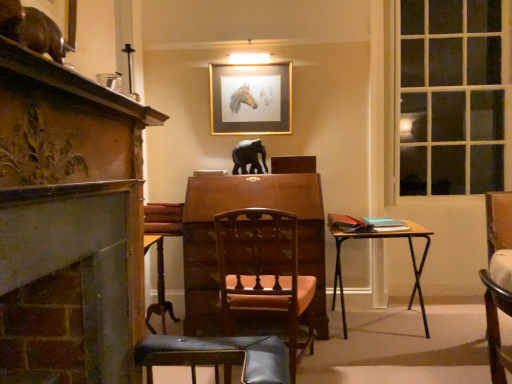
Question: Is gold metallic picture frame at upper center not within carved wood fireplace at left?

Choices:
 (A) no
 (B) yes

Answer: (B)

Question: Does gold metallic picture frame at upper center have a greater width compared to carved wood fireplace at left?

Choices:
 (A) no
 (B) yes

Answer: (A)

Question: Is carved wood fireplace at left surrounded by gold metallic picture frame at upper center?

Choices:
 (A) no
 (B) yes

Answer: (A)

Question: Does gold metallic picture frame at upper center appear on the left side of carved wood fireplace at left?

Choices:
 (A) yes
 (B) no

Answer: (B)

Question: Can you see gold metallic picture frame at upper center touching carved wood fireplace at left?

Choices:
 (A) no
 (B) yes

Answer: (A)

Question: Is gold metallic picture frame at upper center in front of or behind carved wood fireplace at left in the image?

Choices:
 (A) behind
 (B) front

Answer: (A)

Question: Is point (242, 132) positioned closer to the camera than point (99, 228)?

Choices:
 (A) farther
 (B) closer

Answer: (A)

Question: From the image's perspective, relative to carved wood fireplace at left, is gold metallic picture frame at upper center above or below?

Choices:
 (A) below
 (B) above

Answer: (B)

Question: Would you say gold metallic picture frame at upper center is inside or outside carved wood fireplace at left?

Choices:
 (A) inside
 (B) outside

Answer: (B)

Question: Considering the relative positions of wooden table at right and gold metallic picture frame at upper center in the image provided, is wooden table at right to the left or to the right of gold metallic picture frame at upper center?

Choices:
 (A) left
 (B) right

Answer: (B)

Question: Do you think wooden table at right is within gold metallic picture frame at upper center, or outside of it?

Choices:
 (A) inside
 (B) outside

Answer: (B)

Question: From the image's perspective, is wooden table at right positioned above or below gold metallic picture frame at upper center?

Choices:
 (A) below
 (B) above

Answer: (A)

Question: Is wooden table at right bigger or smaller than gold metallic picture frame at upper center?

Choices:
 (A) big
 (B) small

Answer: (A)

Question: From a real-world perspective, is carved wood fireplace at left positioned above or below clear glass window at right?

Choices:
 (A) above
 (B) below

Answer: (B)

Question: Relative to clear glass window at right, is carved wood fireplace at left in front or behind?

Choices:
 (A) behind
 (B) front

Answer: (B)